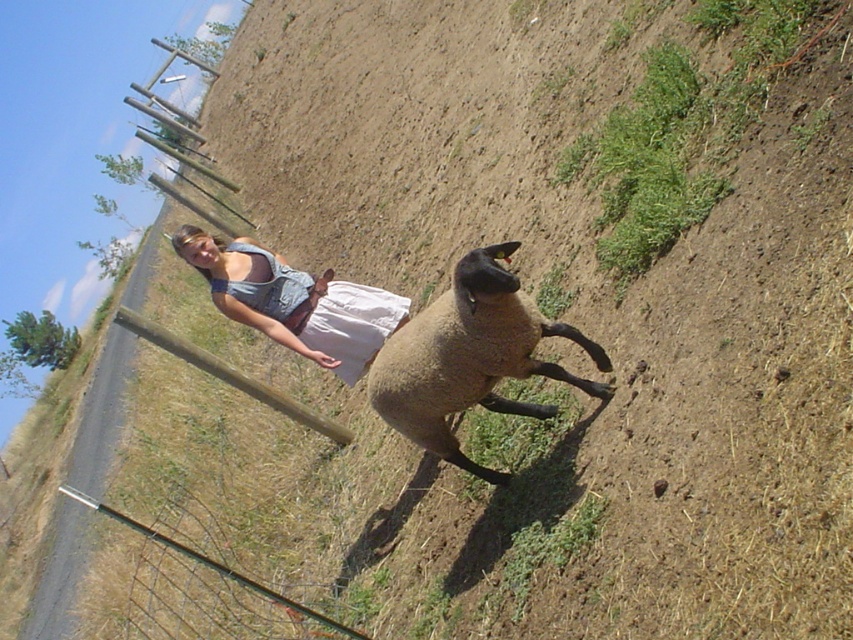
Which is below, brown woolen sheep at center or denim overalls at center?

brown woolen sheep at center is below.

Identify the location of brown woolen sheep at center. The height and width of the screenshot is (640, 853). (469, 356).

Which is in front, point (523, 316) or point (381, 330)?

Point (523, 316) is in front.

Locate an element on the screen. The height and width of the screenshot is (640, 853). brown woolen sheep at center is located at coordinates (469, 356).

Who is lower down, brown woolen sheep at center or metal wire fence at lower left?

metal wire fence at lower left is lower down.

Is brown woolen sheep at center smaller than metal wire fence at lower left?

Incorrect, brown woolen sheep at center is not smaller in size than metal wire fence at lower left.

Which is behind, point (473, 394) or point (349, 628)?

The point (473, 394) is behind.

The height and width of the screenshot is (640, 853). I want to click on brown woolen sheep at center, so click(469, 356).

Can you confirm if denim overalls at center is wider than metal wire fence at lower left?

Yes.

Who is more forward, (370, 308) or (274, 595)?

Point (274, 595) is in front.

Find the location of `denim overalls at center`. denim overalls at center is located at coordinates (294, 301).

Locate an element on the screen. Image resolution: width=853 pixels, height=640 pixels. denim overalls at center is located at coordinates (294, 301).